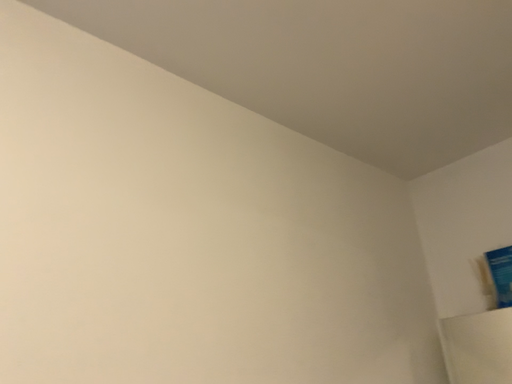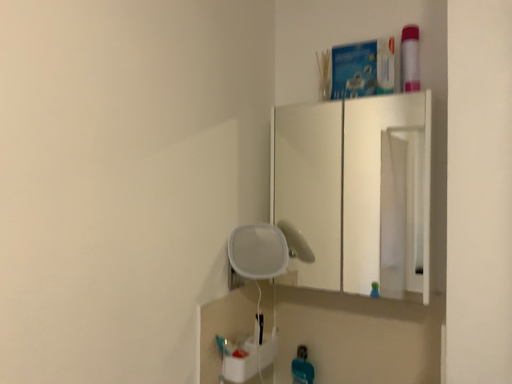
Question: Which way did the camera rotate in the video?

Choices:
 (A) rotated downward
 (B) rotated upward

Answer: (A)